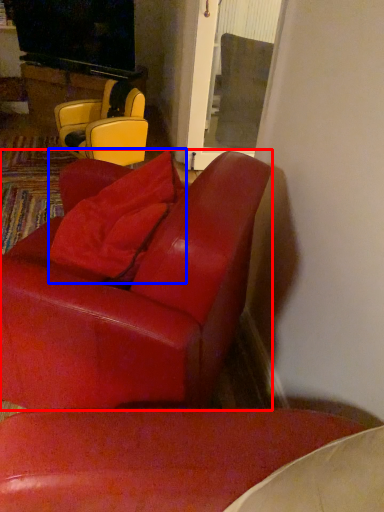
Question: Which of the following is the farthest to the observer, chair (highlighted by a red box) or pillow (highlighted by a blue box)?

Choices:
 (A) chair
 (B) pillow

Answer: (B)